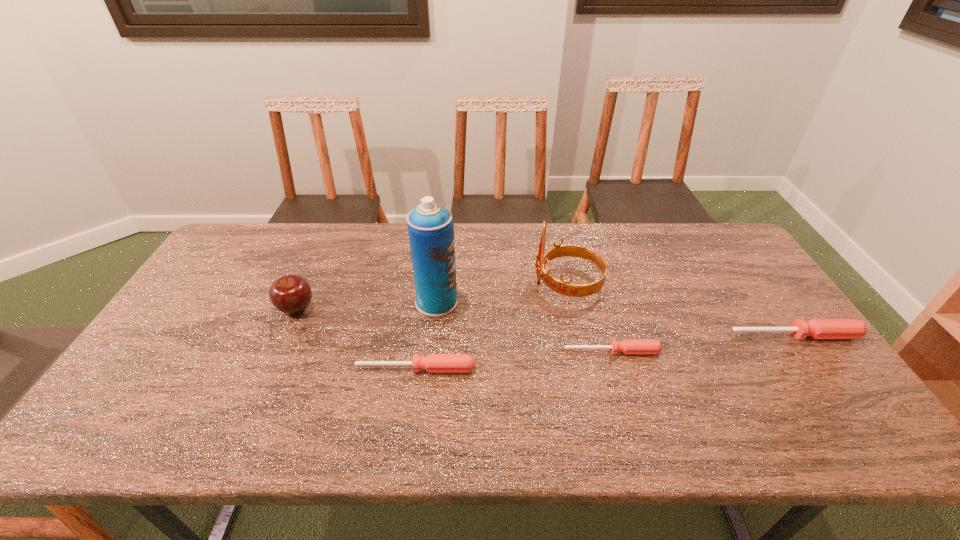
Identify the location of the nearest screwdriver. Image resolution: width=960 pixels, height=540 pixels. (433, 363).

The image size is (960, 540). In order to click on the second shortest object in this screenshot , I will do `click(433, 363)`.

Where is `the second farthest screwdriver`? The height and width of the screenshot is (540, 960). the second farthest screwdriver is located at coordinates (626, 346).

Locate an element on the screen. Image resolution: width=960 pixels, height=540 pixels. the fifth farthest object is located at coordinates (626, 346).

You are a GUI agent. You are given a task and a screenshot of the screen. Output one action in this format:
    pyautogui.click(x=<x>, y=<y>)
    Task: Click on the third nearest object
    The height and width of the screenshot is (540, 960).
    Given the screenshot: What is the action you would take?
    pyautogui.click(x=816, y=328)

Locate an element on the screen. the farthest screwdriver is located at coordinates (816, 328).

Where is `the second tallest object`? the second tallest object is located at coordinates pos(563,287).

The width and height of the screenshot is (960, 540). What are the coordinates of `the third tallest object` in the screenshot? It's located at (291, 294).

Locate an element on the screen. the leftmost object is located at coordinates (291, 294).

The height and width of the screenshot is (540, 960). What are the coordinates of `aerosol can` in the screenshot? It's located at (x=430, y=226).